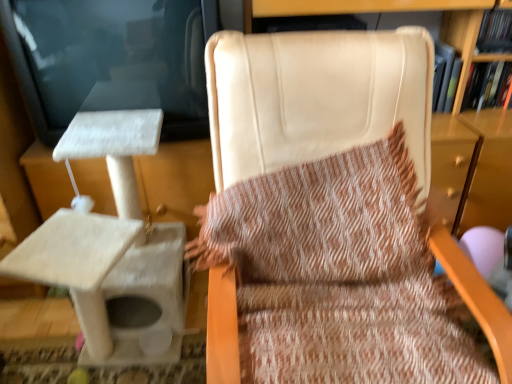
Question: Could you tell me if beige leather chair at center is turned towards hardcover book at upper right?

Choices:
 (A) yes
 (B) no

Answer: (B)

Question: Is beige leather chair at center taller than hardcover book at upper right?

Choices:
 (A) no
 (B) yes

Answer: (B)

Question: Could hardcover book at upper right be considered to be inside beige leather chair at center?

Choices:
 (A) no
 (B) yes

Answer: (A)

Question: Is beige leather chair at center closer to the viewer compared to hardcover book at upper right?

Choices:
 (A) no
 (B) yes

Answer: (B)

Question: From a real-world perspective, is beige leather chair at center physically below hardcover book at upper right?

Choices:
 (A) no
 (B) yes

Answer: (B)

Question: Is beige leather chair at center inside the boundaries of white textured cat tree at left, or outside?

Choices:
 (A) outside
 (B) inside

Answer: (A)

Question: From a real-world perspective, is beige leather chair at center positioned above or below white textured cat tree at left?

Choices:
 (A) below
 (B) above

Answer: (B)

Question: From the image's perspective, relative to white textured cat tree at left, is beige leather chair at center above or below?

Choices:
 (A) below
 (B) above

Answer: (A)

Question: Looking at the image, does beige leather chair at center seem bigger or smaller compared to white textured cat tree at left?

Choices:
 (A) big
 (B) small

Answer: (A)

Question: Visually, is beige leather chair at center positioned to the left or to the right of hardcover book at upper right?

Choices:
 (A) left
 (B) right

Answer: (A)

Question: Looking at the image, does beige leather chair at center seem bigger or smaller compared to hardcover book at upper right?

Choices:
 (A) big
 (B) small

Answer: (A)

Question: In the image, is beige leather chair at center positioned in front of or behind hardcover book at upper right?

Choices:
 (A) behind
 (B) front

Answer: (B)

Question: From the image's perspective, is beige leather chair at center above or below hardcover book at upper right?

Choices:
 (A) below
 (B) above

Answer: (A)

Question: Is hardcover book at upper right to the left or to the right of beige leather chair at center in the image?

Choices:
 (A) left
 (B) right

Answer: (B)

Question: Is point (480, 94) positioned closer to the camera than point (509, 345)?

Choices:
 (A) closer
 (B) farther

Answer: (B)